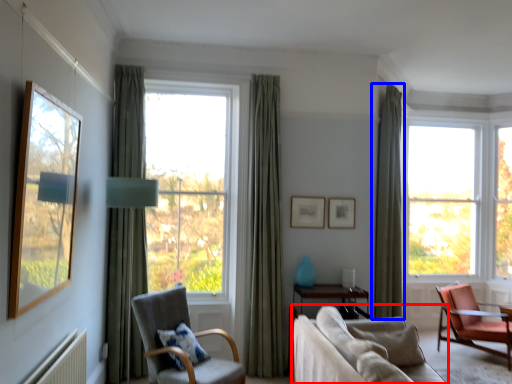
Question: Which point is further to the camera, studio couch (highlighted by a red box) or curtain (highlighted by a blue box)?

Choices:
 (A) studio couch
 (B) curtain

Answer: (B)